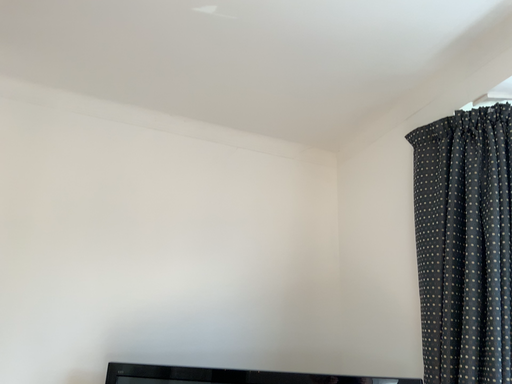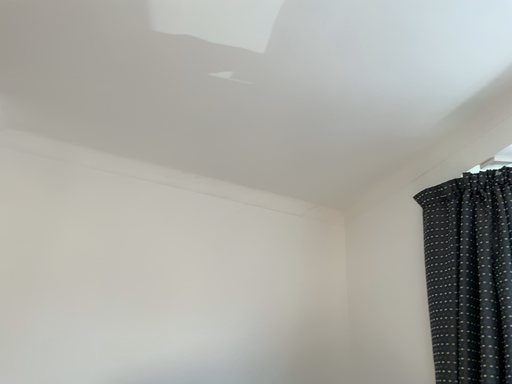
Question: How did the camera likely rotate when shooting the video?

Choices:
 (A) rotated upward
 (B) rotated downward

Answer: (A)